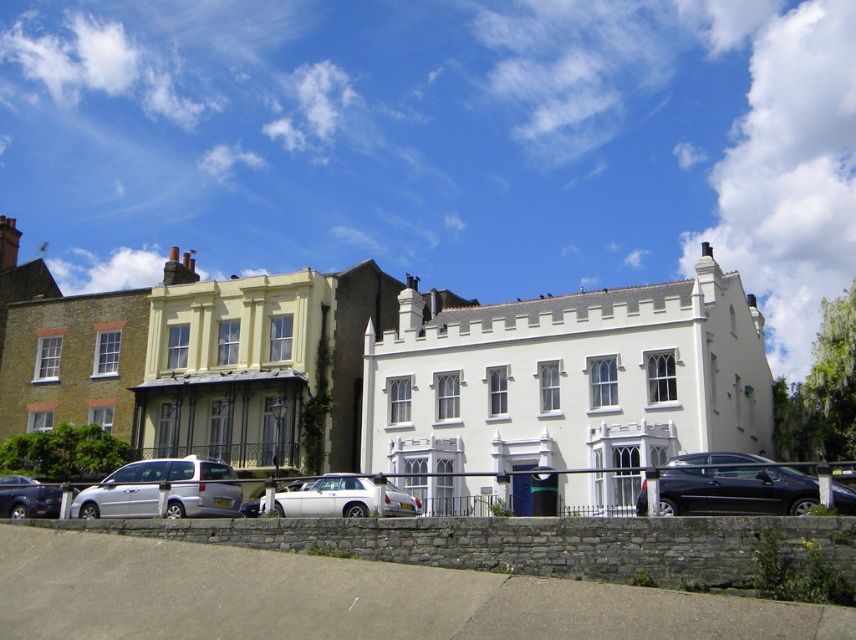
Who is higher up, shiny black sedan at center right or white glossy sedan at center?

shiny black sedan at center right

How much distance is there between shiny black sedan at center right and white glossy sedan at center?

shiny black sedan at center right and white glossy sedan at center are 16.78 meters apart.

Who is more forward, (846,492) or (345,497)?

Point (846,492)

The width and height of the screenshot is (856, 640). In order to click on shiny black sedan at center right in this screenshot , I will do `click(733, 486)`.

Is shiny black sedan at center right smaller than shiny black sedan at lower left?

Correct, shiny black sedan at center right occupies less space than shiny black sedan at lower left.

Who is shorter, shiny black sedan at center right or shiny black sedan at lower left?

With less height is shiny black sedan at lower left.

Where is `shiny black sedan at center right`? shiny black sedan at center right is located at coordinates (733, 486).

The image size is (856, 640). I want to click on shiny black sedan at center right, so click(733, 486).

Who is lower down, white glossy sedan at center or shiny black sedan at lower left?

shiny black sedan at lower left is lower down.

Measure the distance between white glossy sedan at center and camera.

white glossy sedan at center and camera are 132.69 feet apart from each other.

This screenshot has width=856, height=640. What are the coordinates of `white glossy sedan at center` in the screenshot? It's located at (327, 497).